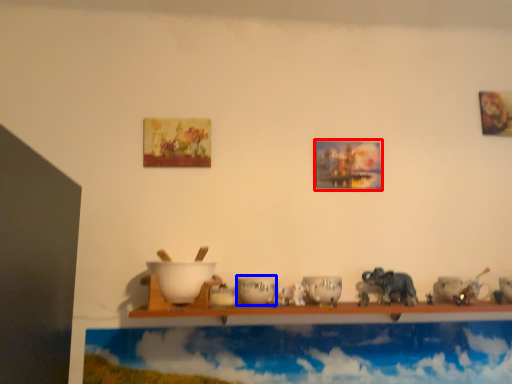
Question: Which object is closer to the camera taking this photo, picture frame (highlighted by a red box) or tableware (highlighted by a blue box)?

Choices:
 (A) picture frame
 (B) tableware

Answer: (B)